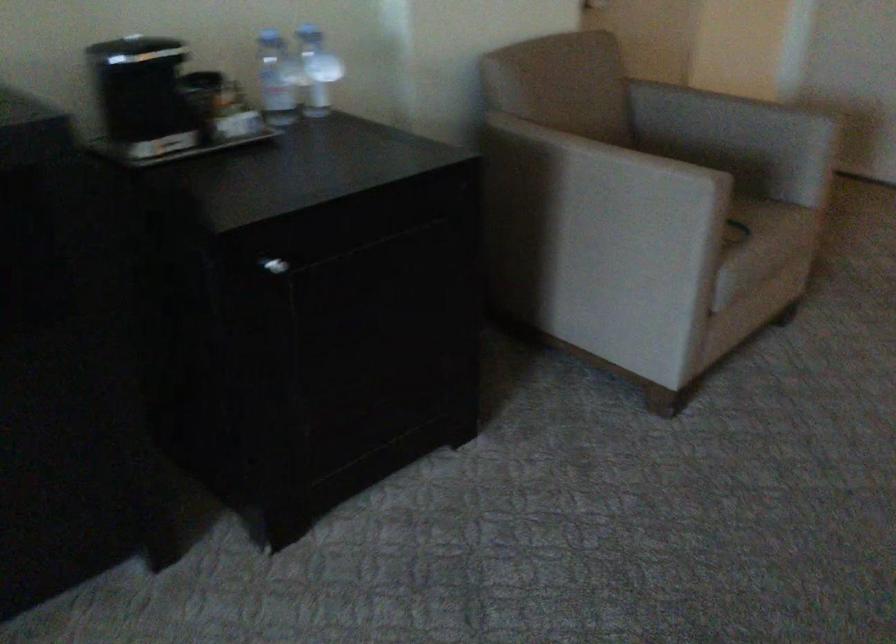
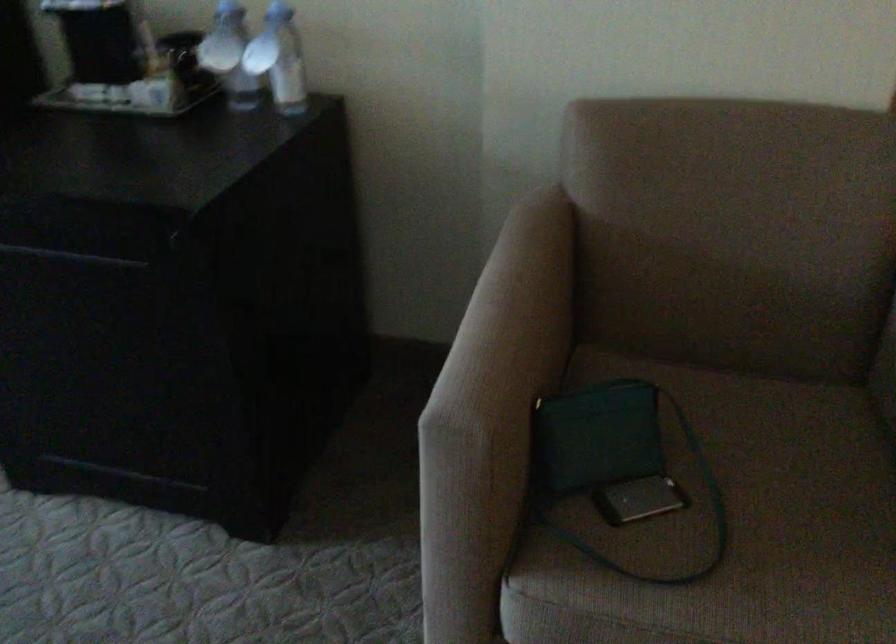
The point at (x=317, y=73) is marked in the first image. Where is the corresponding point in the second image?

(279, 59)